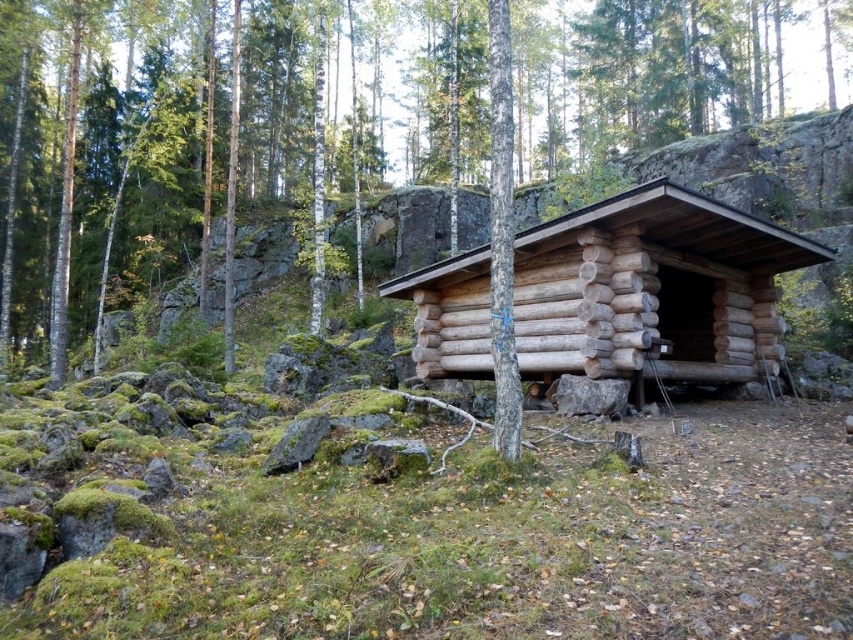
Question: Does brown wood log cabin at center come in front of natural wood log cabin at center?

Choices:
 (A) yes
 (B) no

Answer: (A)

Question: Can you confirm if brown wood log cabin at center is positioned to the right of natural wood log cabin at center?

Choices:
 (A) yes
 (B) no

Answer: (A)

Question: Which point appears closest to the camera in this image?

Choices:
 (A) (636, 198)
 (B) (675, 328)

Answer: (A)

Question: Does brown wood log cabin at center come behind natural wood log cabin at center?

Choices:
 (A) no
 (B) yes

Answer: (A)

Question: Which point is farther from the camera taking this photo?

Choices:
 (A) (230, 262)
 (B) (570, 232)

Answer: (A)